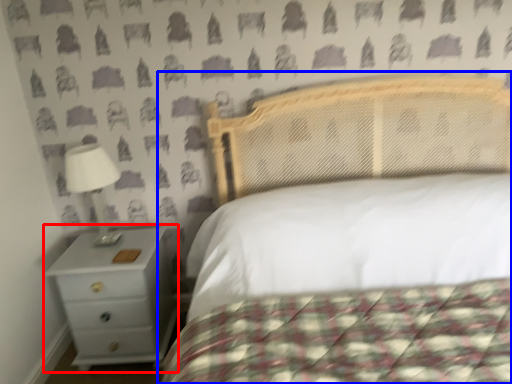
Question: Which object is further to the camera taking this photo, nightstand (highlighted by a red box) or bed (highlighted by a blue box)?

Choices:
 (A) nightstand
 (B) bed

Answer: (A)